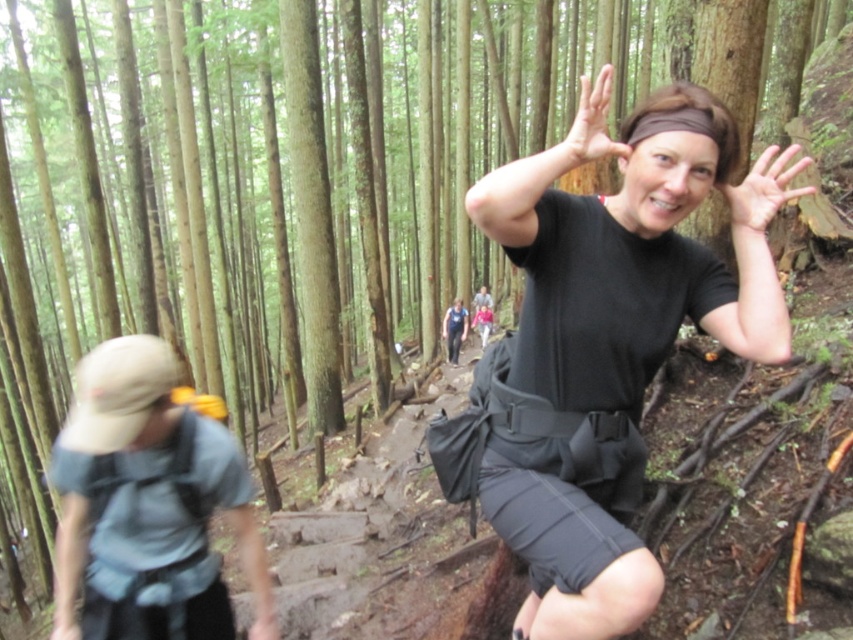
Question: Does smooth skin hand at upper center have a smaller size compared to matte black hand at upper center?

Choices:
 (A) yes
 (B) no

Answer: (A)

Question: Does black matte shorts at center have a larger size compared to smooth skin hand at upper center?

Choices:
 (A) yes
 (B) no

Answer: (A)

Question: Can you confirm if smooth skin hand at upper center is thinner than matte black hand at upper center?

Choices:
 (A) no
 (B) yes

Answer: (B)

Question: Estimate the real-world distances between objects in this image. Which object is farther from the smooth skin hand at upper center?

Choices:
 (A) light blue fabric shirt at left
 (B) black matte shorts at center
 (C) matte black hand at upper center

Answer: (A)

Question: Among these points, which one is nearest to the camera?

Choices:
 (A) pyautogui.click(x=598, y=141)
 (B) pyautogui.click(x=706, y=305)
 (C) pyautogui.click(x=763, y=218)

Answer: (A)

Question: Among these points, which one is nearest to the camera?

Choices:
 (A) (151, 432)
 (B) (573, 148)
 (C) (763, 212)

Answer: (B)